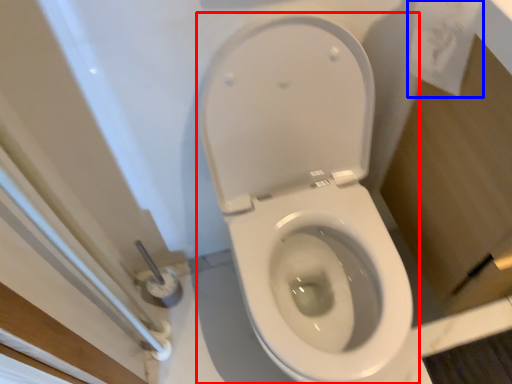
Question: Which object is closer to the camera taking this photo, toilet (highlighted by a red box) or toilet paper (highlighted by a blue box)?

Choices:
 (A) toilet
 (B) toilet paper

Answer: (A)